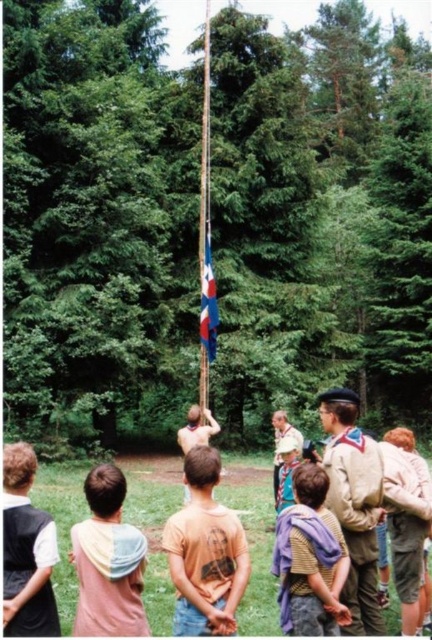
You are standing in the forest and want to reach the point marked at coordinates point (89, 625). The path ahead is clear, but you have a 5 meter rope. Is the rope long enough to reach that point from your current position?

The distance of point (89, 625) from viewer is 4.46 meters, so yes, the 5 meter rope is long enough to reach that point.

You are standing in the forest scene and want to find the brown cotton shirt at center. Which direction should you look relative to the white cotton shirt at lower left?

The brown cotton shirt at center is below the white cotton shirt at lower left, so you should look downward from the white cotton shirt at lower left to find it.